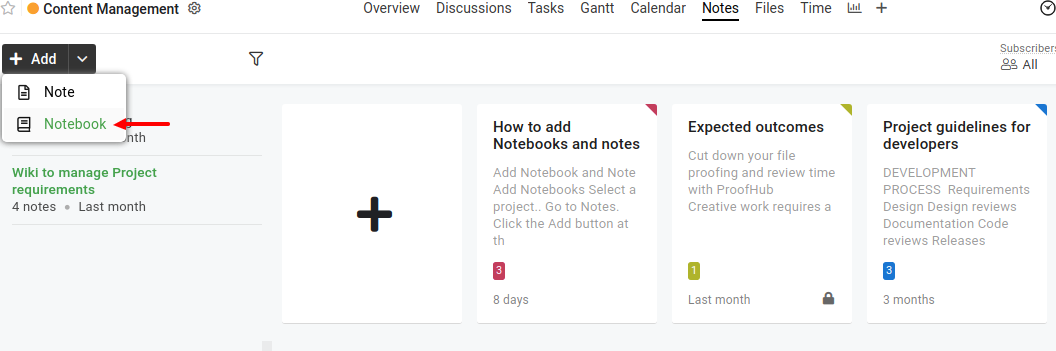
You are a GUI agent. You are given a task and a screenshot of the screen. Output one action in this format:
    pyautogui.click(x=<x>, y=<y>)
    Task: Click on the note with blue tag
    This screenshot has height=351, width=1056.
    Given the screenshot: What is the action you would take?
    pyautogui.click(x=961, y=200)